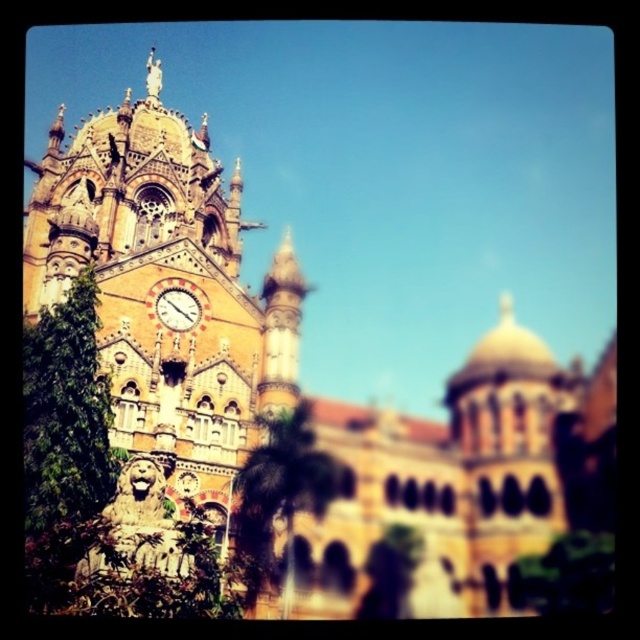
You are standing in front of the grand building and notice two green leafy trees in the foreground. Which tree, the green leafy tree at lower right or the green leafy tree at lower center, is taller?

The green leafy tree at lower center is taller than the green leafy tree at lower right.